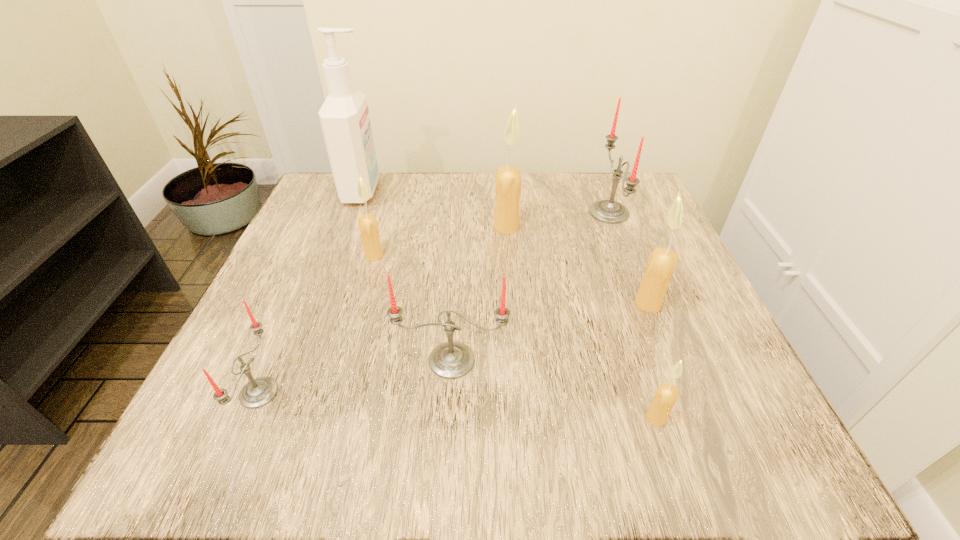
The image size is (960, 540). What are the coordinates of `free point that satisfies the following two spatial constraints: 1. on the front-facing side of the rightmost red candle; 2. on the right side of the fourth farthest candle` in the screenshot? It's located at (644, 303).

At what (x,y) coordinates should I click in order to perform the action: click on vacant area that satisfies the following two spatial constraints: 1. on the front label of the fourth nearest candle; 2. on the right side of the tallest object. Please return your answer as a coordinate pair (x, y). The width and height of the screenshot is (960, 540). Looking at the image, I should click on (320, 303).

At what (x,y) coordinates should I click in order to perform the action: click on vacant point that satisfies the following two spatial constraints: 1. on the front label of the tallest object; 2. on the back side of the smallest cream candle. Please return your answer as a coordinate pair (x, y). Looking at the image, I should click on (276, 418).

Locate an element on the screen. The width and height of the screenshot is (960, 540). free location that satisfies the following two spatial constraints: 1. on the front label of the third biggest cream candle; 2. on the right side of the tallest object is located at coordinates (338, 255).

The image size is (960, 540). In order to click on blank area in the image that satisfies the following two spatial constraints: 1. on the front label of the cleansing agent; 2. on the left side of the third cream candle from left to right in this screenshot , I will do `click(276, 418)`.

You are a GUI agent. You are given a task and a screenshot of the screen. Output one action in this format:
    pyautogui.click(x=<x>, y=<y>)
    Task: Click on the vacant region that satisfies the following two spatial constraints: 1. on the back side of the fourth nearest object; 2. on the front label of the cleansing agent
    
    Given the screenshot: What is the action you would take?
    pyautogui.click(x=603, y=191)